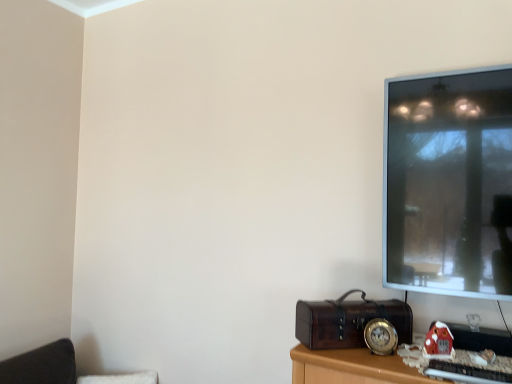
Question: Is matte plastic toy house at lower right taller or shorter than velvet black cushion at lower left?

Choices:
 (A) tall
 (B) short

Answer: (B)

Question: Do you think matte plastic toy house at lower right is within velvet black cushion at lower left, or outside of it?

Choices:
 (A) inside
 (B) outside

Answer: (B)

Question: Based on their sizes in the image, would you say matte plastic toy house at lower right is bigger or smaller than velvet black cushion at lower left?

Choices:
 (A) small
 (B) big

Answer: (A)

Question: Is velvet black cushion at lower left wider or thinner than matte plastic toy house at lower right?

Choices:
 (A) thin
 (B) wide

Answer: (B)

Question: Which is correct: velvet black cushion at lower left is inside matte plastic toy house at lower right, or outside of it?

Choices:
 (A) inside
 (B) outside

Answer: (B)

Question: From the image's perspective, is velvet black cushion at lower left located above or below matte plastic toy house at lower right?

Choices:
 (A) below
 (B) above

Answer: (A)

Question: Considering the positions of velvet black cushion at lower left and matte plastic toy house at lower right in the image, is velvet black cushion at lower left taller or shorter than matte plastic toy house at lower right?

Choices:
 (A) short
 (B) tall

Answer: (B)